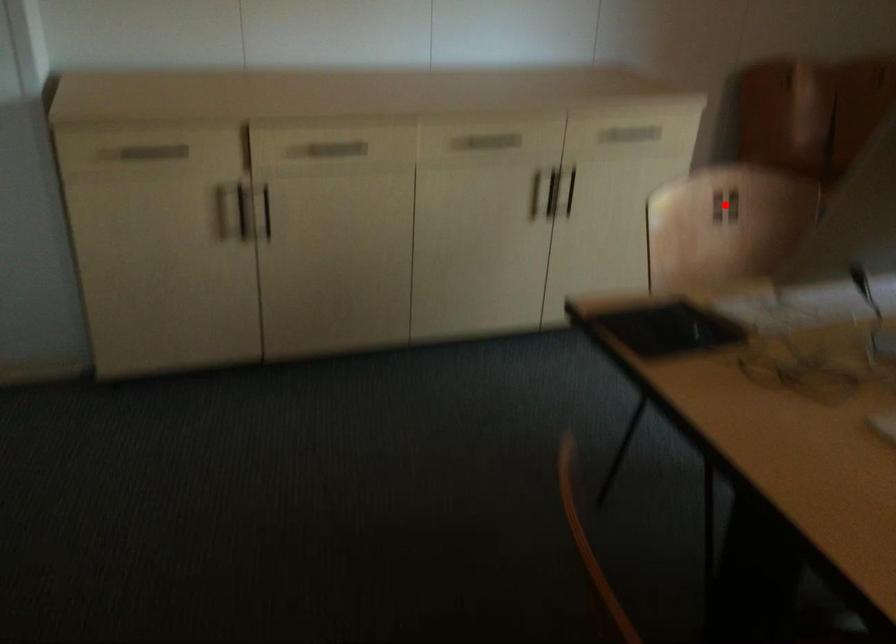
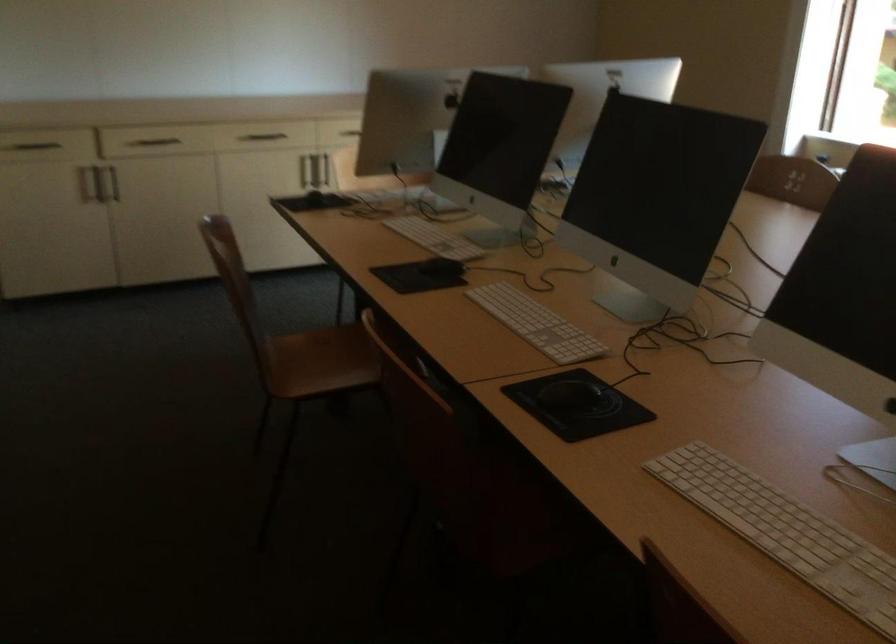
Question: I am providing you with two images of the same scene from different viewpoints. A red point is marked on the first image. Can you still see the location of the red point in image 2?

Choices:
 (A) Yes
 (B) No

Answer: (B)